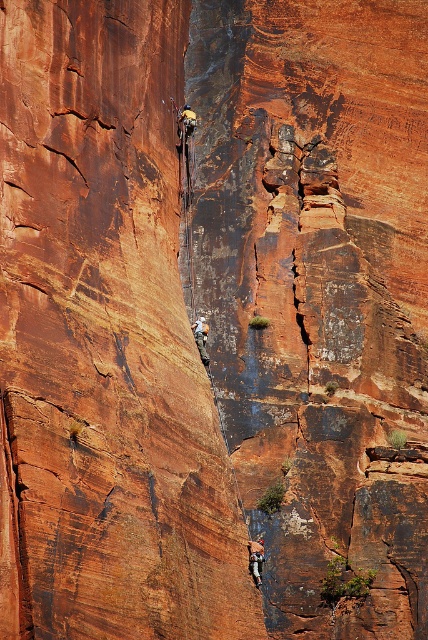
You are a rock climber preparing to ascend the cliff. You notice a matte climbing harness at center and a matte gray rock climber at center. Which object is wider?

The matte gray rock climber at center is wider than the matte climbing harness at center.

You are a beginner climber assessing the safety of your gear. You notice two items at the center of your viewfinder while preparing to climb the steep, reddish cliff. One is a matte climbing harness at center and the other is a matte gray rock climber at center. Which object appears bigger in your view?

The matte climbing harness at center is larger in size than the matte gray rock climber at center, so the matte climbing harness at center appears bigger in your view.

You are a safety inspector evaluating the climbing setup. You notice the matte climbing harness at center and the matte gray rock climber at center. Which object is closer to the inspector observing from the ground?

The matte climbing harness at center is closer to the inspector because it is in front of the matte gray rock climber at center.